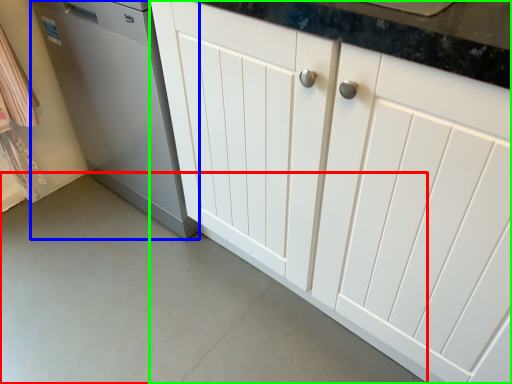
Question: Which object is the farthest from concrete (highlighted by a red box)? Choose among these: home appliance (highlighted by a blue box) or cabinetry (highlighted by a green box).

Choices:
 (A) home appliance
 (B) cabinetry

Answer: (B)